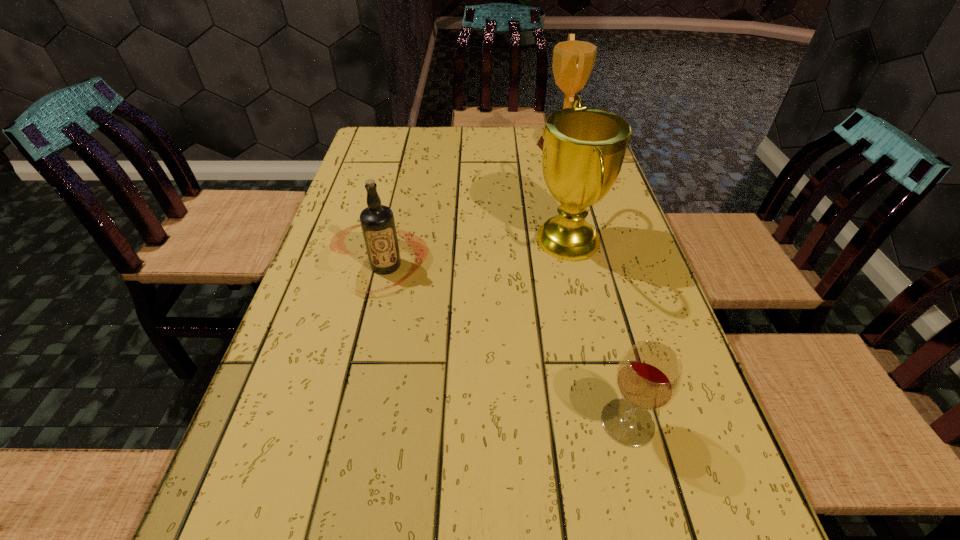
Find the location of a particular element. The width and height of the screenshot is (960, 540). free location that satisfies the following two spatial constraints: 1. on the label of the shortest object; 2. on the left side of the third tallest object is located at coordinates (350, 422).

This screenshot has width=960, height=540. In order to click on free space in the image that satisfies the following two spatial constraints: 1. on the label of the second shortest object; 2. on the left side of the wineglass in this screenshot , I will do click(x=350, y=422).

The image size is (960, 540). What are the coordinates of `free spot that satisfies the following two spatial constraints: 1. on the label of the third tallest object; 2. on the right side of the shortest object` in the screenshot? It's located at point(350,422).

The image size is (960, 540). What are the coordinates of `vacant space that satisfies the following two spatial constraints: 1. on the shiny surface of the nearer award; 2. on the left side of the wineglass` in the screenshot? It's located at pyautogui.click(x=609, y=422).

Identify the location of blank space that satisfies the following two spatial constraints: 1. on the label of the nearest object; 2. on the left side of the leftmost object. This screenshot has height=540, width=960. (350, 422).

What are the coordinates of `vacant space that satisfies the following two spatial constraints: 1. on the front-facing side of the farther award; 2. on the front side of the nearest object` in the screenshot? It's located at (639, 422).

Locate an element on the screen. free point that satisfies the following two spatial constraints: 1. on the back side of the wineglass; 2. on the shiny surface of the nearer award is located at coordinates (581, 241).

At what (x,y) coordinates should I click in order to perform the action: click on free spot that satisfies the following two spatial constraints: 1. on the label of the wineglass; 2. on the right side of the third tallest object. Please return your answer as a coordinate pair (x, y). This screenshot has width=960, height=540. Looking at the image, I should click on (350, 422).